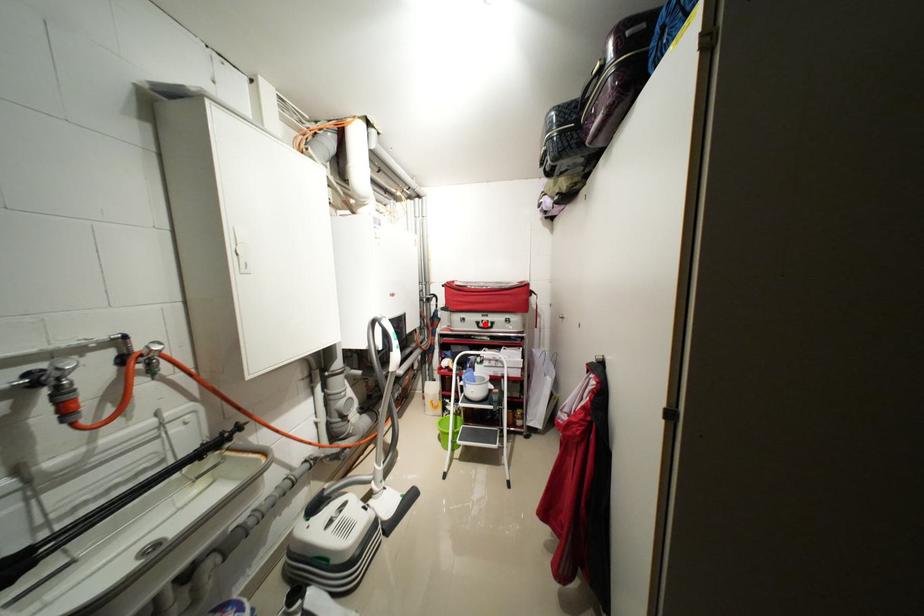
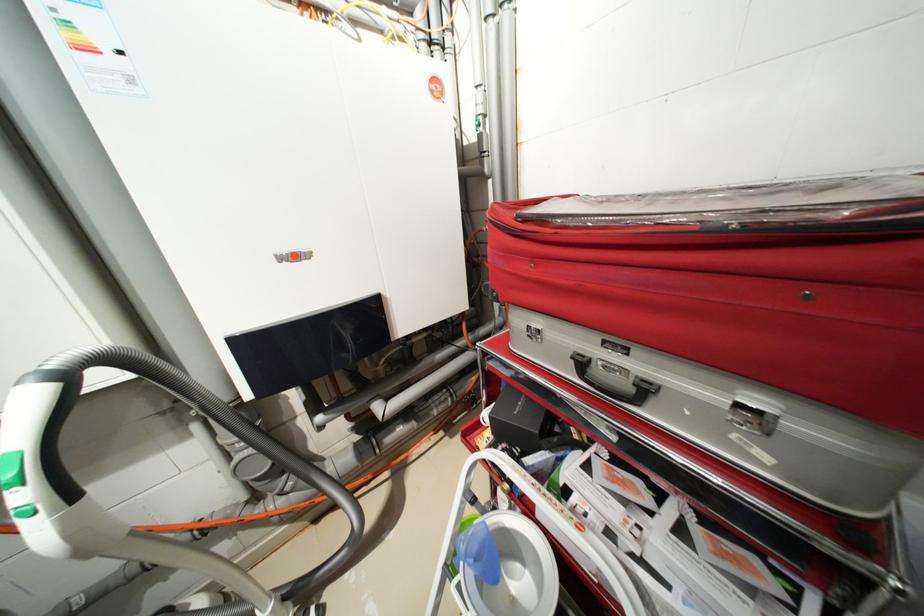
In the second image, find the point that corresponds to the highlighted location in the first image.

(589, 363)